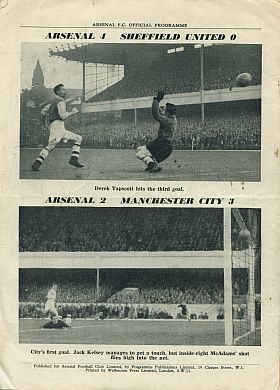
At what (x,y) coordinates should I click in order to perform the action: click on poster. Please return your answer as a coordinate pair (x, y). The height and width of the screenshot is (390, 280). Looking at the image, I should click on (6, 170).